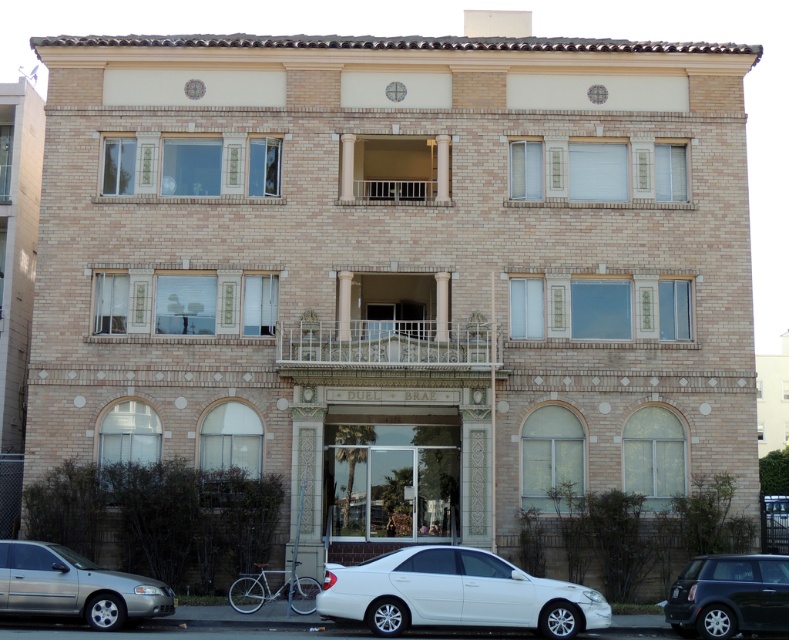
Question: Estimate the real-world distances between objects in this image. Which object is farther from the white wrought iron balcony at center?

Choices:
 (A) white glossy sedan at lower center
 (B) metallic silver balcony at center
 (C) shiny black car at lower right

Answer: (C)

Question: Which point is closer to the camera?

Choices:
 (A) (413, 198)
 (B) (608, 624)
 (C) (417, 365)

Answer: (B)

Question: Is white glossy sedan at lower center wider than shiny black car at lower right?

Choices:
 (A) no
 (B) yes

Answer: (A)

Question: Does silver metallic sedan at lower left come in front of metallic silver balcony at center?

Choices:
 (A) no
 (B) yes

Answer: (B)

Question: Which point appears closest to the camera in this image?

Choices:
 (A) tap(36, 579)
 (B) tap(421, 180)
 (C) tap(391, 324)

Answer: (A)

Question: Can you confirm if white wrought iron balcony at center is thinner than metallic silver balcony at center?

Choices:
 (A) yes
 (B) no

Answer: (A)